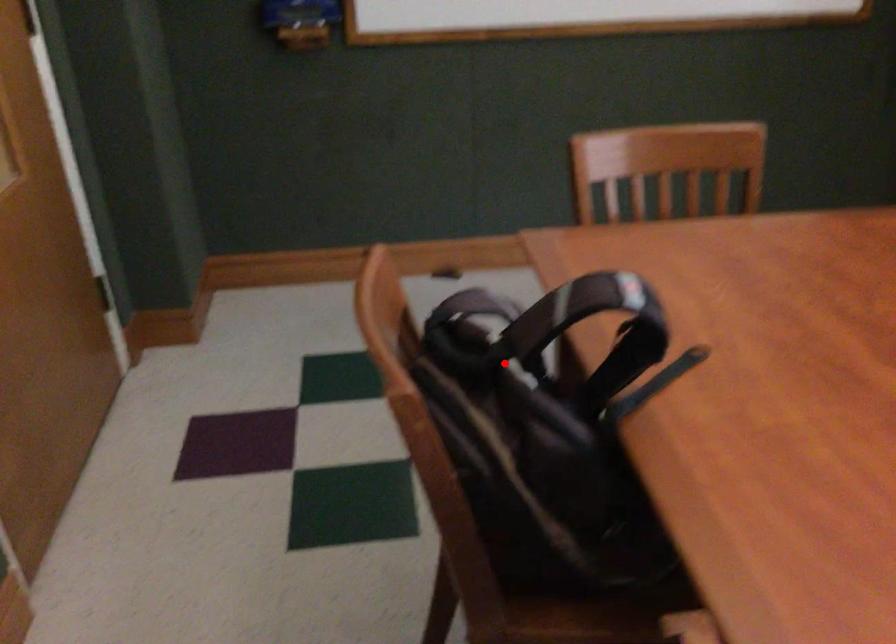
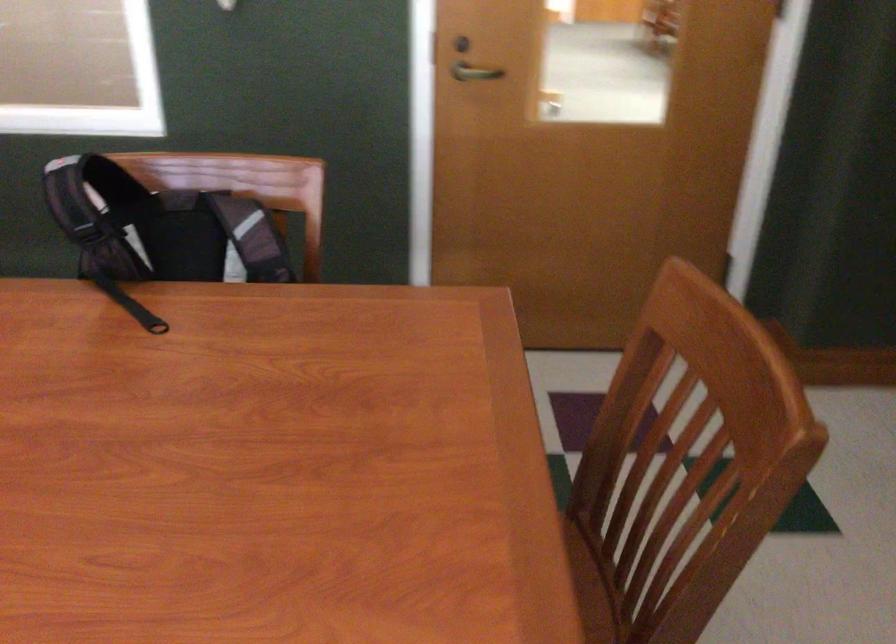
Find the pixel in the second image that matches the highlighted location in the first image.

(159, 228)